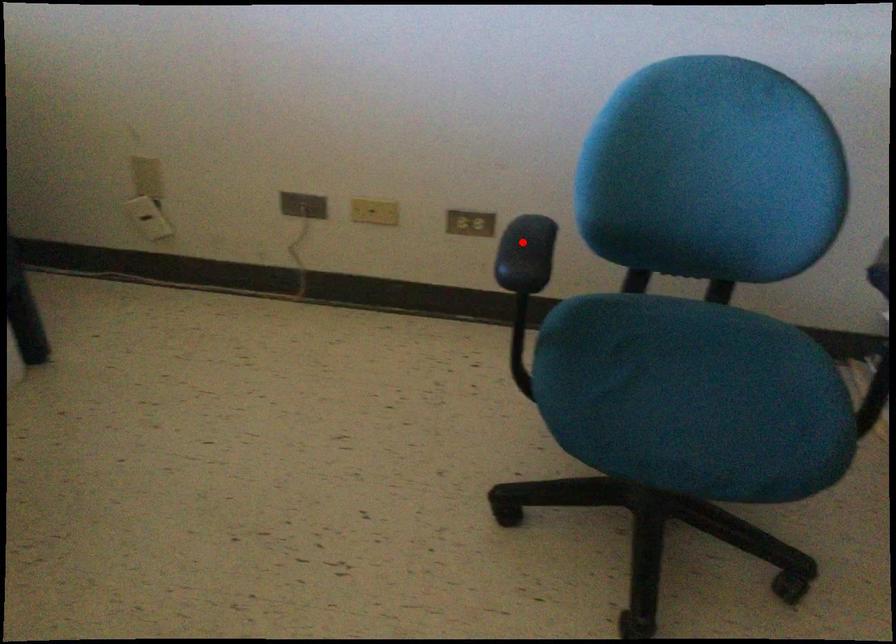
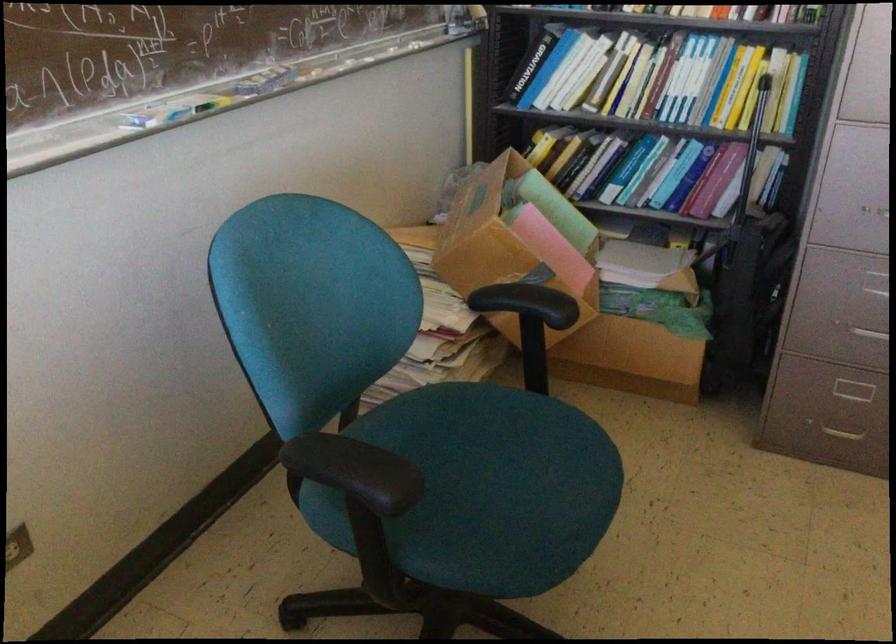
Question: I am providing you with two images of the same scene from different viewpoints. Image1 has a red point marked. In image2, the corresponding 3D location appears at what relative position? Reply with the corresponding letter.

Choices:
 (A) Closer
 (B) Farther

Answer: (A)